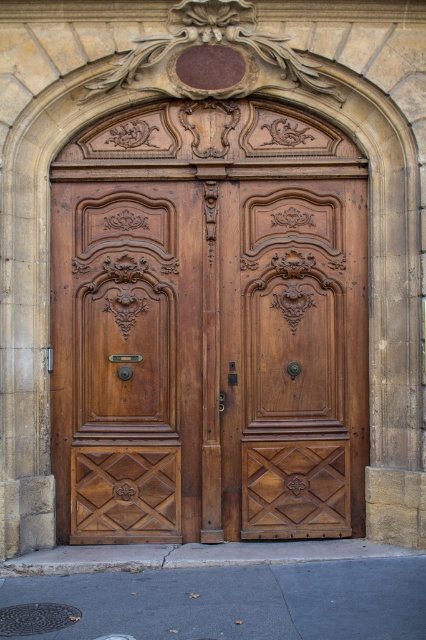
Question: Does polished wood door at center appear on the right side of matte wood door at center?

Choices:
 (A) no
 (B) yes

Answer: (A)

Question: Does polished wood door at center have a greater width compared to matte wood door at center?

Choices:
 (A) yes
 (B) no

Answer: (A)

Question: Which point is closer to the camera taking this photo?

Choices:
 (A) (293, 243)
 (B) (77, 504)

Answer: (B)

Question: Which of the following is the farthest from the observer?

Choices:
 (A) matte wood door at center
 (B) polished wood door at center

Answer: (A)

Question: Which of the following is the farthest from the observer?

Choices:
 (A) (146, 241)
 (B) (236, 531)

Answer: (A)

Question: Is polished wood door at center to the left of matte wood door at center from the viewer's perspective?

Choices:
 (A) no
 (B) yes

Answer: (B)